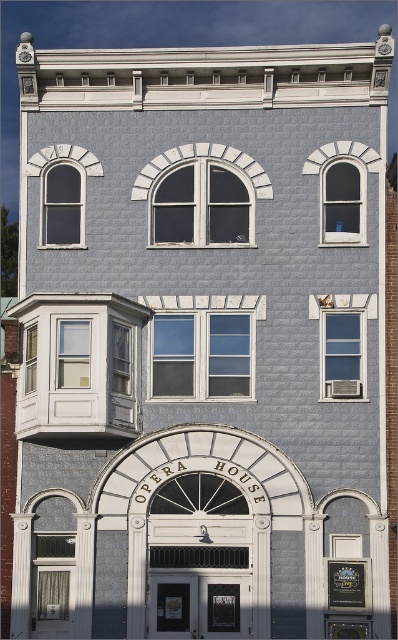
You are an architect reviewing the Opera House facade. You need to determine which of the two clear glass windows, the clear glass window at right or the clear glass window at upper center, has a narrower width. Which one is it?

The clear glass window at right is thinner than the clear glass window at upper center, so the clear glass window at right has a narrower width.

You are standing in front of the Opera House and notice two windows on the left side of the building. Which window is positioned further to the left between the matte gray window at upper left and the matte glass window at left?

The matte gray window at upper left is positioned further to the left compared to the matte glass window at left.

You are standing in front of the Opera House and notice a specific point marked at coordinates (62, 205). Can you determine which architectural feature this point corresponds to?

The point (62, 205) is located on the matte gray window at upper left.